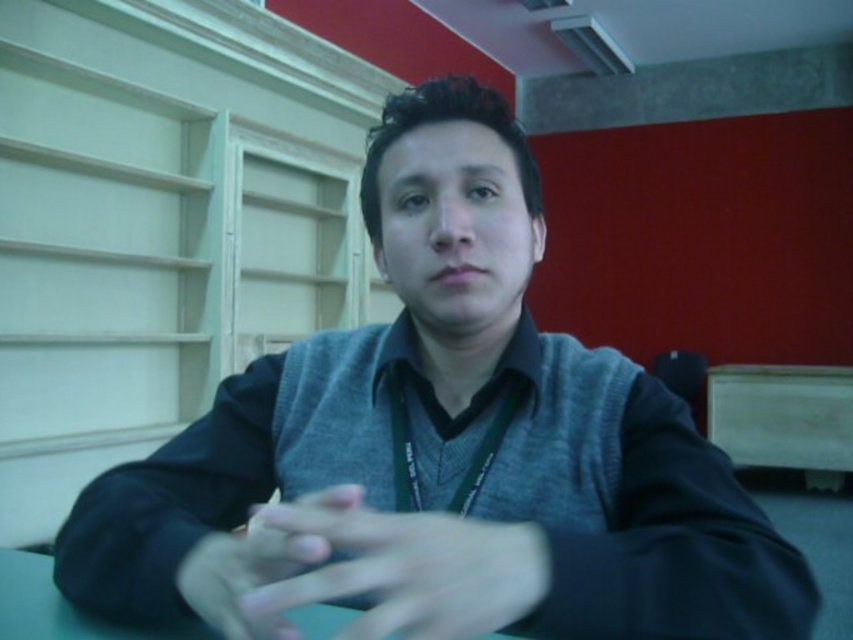
What do you see at coordinates (408, 566) in the screenshot? I see `smooth skin hand at center` at bounding box center [408, 566].

Between point (532, 596) and point (289, 541), which one is positioned behind?

Positioned behind is point (532, 596).

The width and height of the screenshot is (853, 640). Find the location of `smooth skin hand at center`. smooth skin hand at center is located at coordinates (408, 566).

From the picture: Does matte gray hand at center have a larger size compared to green matte table at center?

Incorrect, matte gray hand at center is not larger than green matte table at center.

Locate an element on the screen. The height and width of the screenshot is (640, 853). matte gray hand at center is located at coordinates (242, 577).

Can you confirm if smooth skin hand at center is positioned below green matte table at center?

Incorrect, smooth skin hand at center is not positioned below green matte table at center.

Is smooth skin hand at center in front of green matte table at center?

Yes.

You are a GUI agent. You are given a task and a screenshot of the screen. Output one action in this format:
    pyautogui.click(x=<x>, y=<y>)
    Task: Click on the smooth skin hand at center
    The width and height of the screenshot is (853, 640).
    Given the screenshot: What is the action you would take?
    pyautogui.click(x=408, y=566)

Image resolution: width=853 pixels, height=640 pixels. Identify the location of smooth skin hand at center. (408, 566).